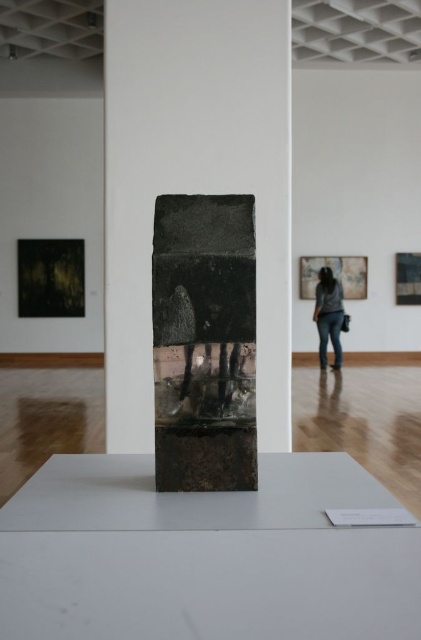
You are standing in the art gallery and see two points marked in the image. The first point is at coordinates point (199, 200) and the second is at point (327, 268). Which point is closer to you?

Point (199, 200) is closer to the camera than point (327, 268).

You are an art critic standing in the gallery. You notice the black stone sculpture at center and the denim jeans at center. Which object takes up more space visually in the image?

The denim jeans at center takes up more space visually in the image because the black stone sculpture at center is smaller than denim jeans at center according to the description.

You are standing in the art gallery and want to get a closer look at the point marked at coordinates point (210, 486). If you move forward by 50 centimeters, will you be within 40 centimeters of that point?

The distance of point (210, 486) from viewer is 88.48 centimeters. Moving forward by 50 centimeters would bring you to 38.48 centimeters away from the point, which is within the 40 centimeters threshold. Yes, you will be within 40 centimeters of that point.